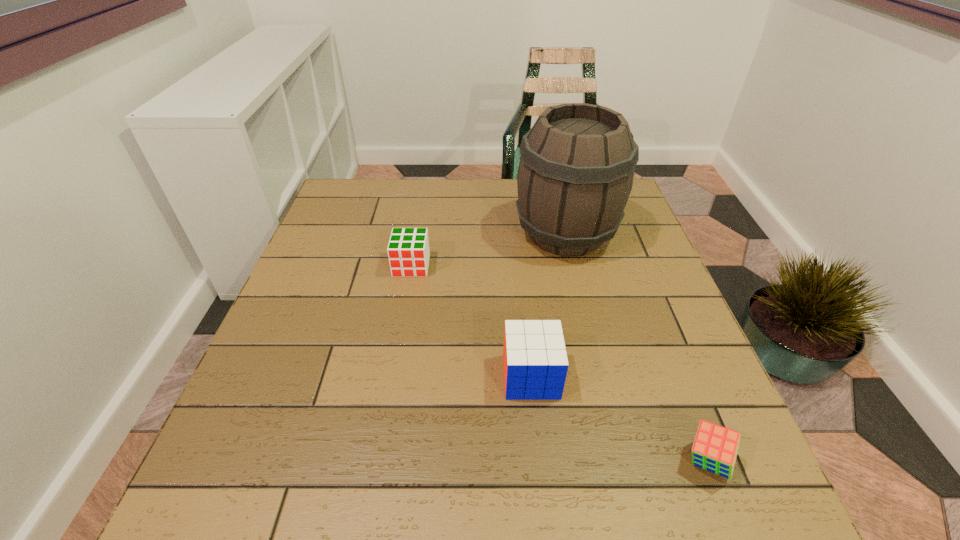
At what (x,y) coordinates should I click in order to perform the action: click on free space located 0.400m on the back of the nearest object. Please return your answer as a coordinate pair (x, y). Looking at the image, I should click on (638, 284).

The width and height of the screenshot is (960, 540). Find the location of `object situated at the far edge`. object situated at the far edge is located at coordinates (576, 169).

I want to click on object at the near edge, so click(x=715, y=448).

The image size is (960, 540). Identify the location of wine bucket present at the right edge. (576, 169).

Find the location of a particular element. cube situated at the right edge is located at coordinates (715, 448).

I want to click on object that is at the far right corner, so click(576, 169).

The height and width of the screenshot is (540, 960). I want to click on object that is positioned at the near right corner, so click(715, 448).

Where is `free space at the far edge`? The width and height of the screenshot is (960, 540). free space at the far edge is located at coordinates (439, 217).

In the image, there is a desktop. Identify the location of vacant space at the near edge. The image size is (960, 540). (376, 501).

In the image, there is a desktop. Where is `vacant region at the left edge`? This screenshot has width=960, height=540. vacant region at the left edge is located at coordinates (335, 273).